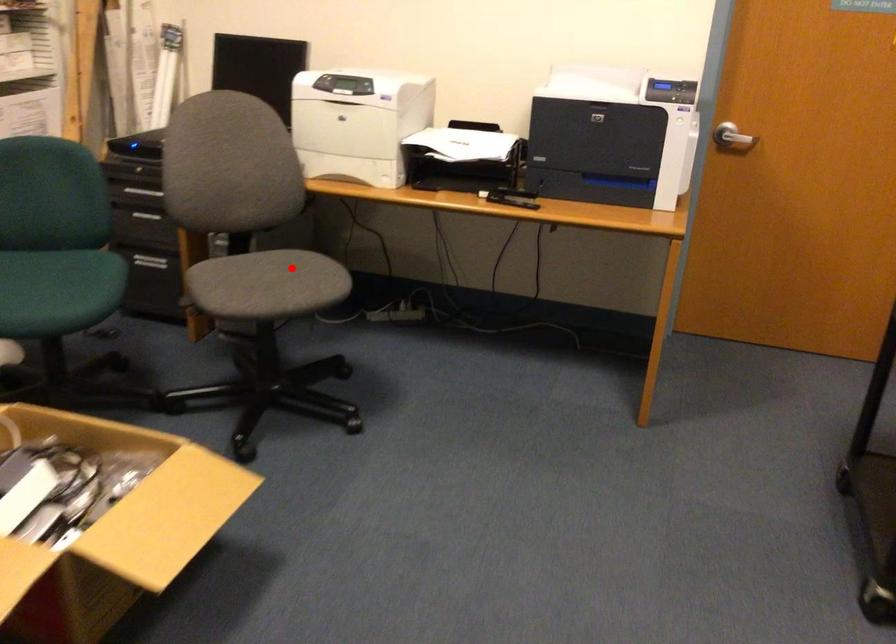
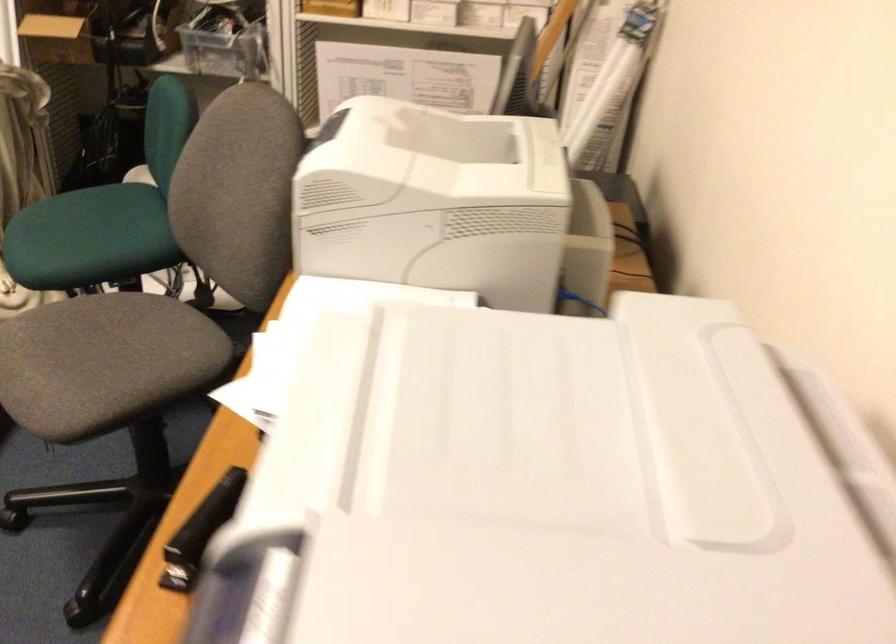
Question: I am providing you with two images of the same scene from different viewpoints. A red point is shown in image1. For the corresponding object point in image2, is it positioned nearer or farther from the camera?

Choices:
 (A) Nearer
 (B) Farther

Answer: (A)